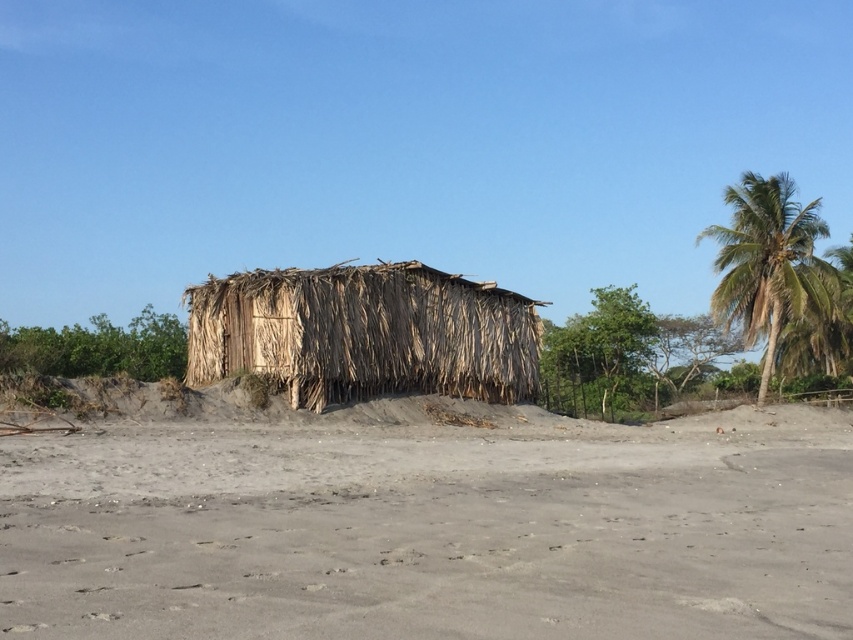
Does point (509, 314) come farther from viewer compared to point (790, 269)?

That is False.

Between dry grass hut at center and green leafy palm tree at upper right, which one has less height?

dry grass hut at center is shorter.

The height and width of the screenshot is (640, 853). Describe the element at coordinates (364, 333) in the screenshot. I see `dry grass hut at center` at that location.

The width and height of the screenshot is (853, 640). I want to click on dry grass hut at center, so click(x=364, y=333).

Does gray sandy beach at center have a smaller size compared to green leafy palm tree at upper right?

Indeed, gray sandy beach at center has a smaller size compared to green leafy palm tree at upper right.

The height and width of the screenshot is (640, 853). I want to click on gray sandy beach at center, so click(433, 531).

Is gray sandy beach at center taller than dry grass hut at center?

In fact, gray sandy beach at center may be shorter than dry grass hut at center.

Looking at this image, is the position of gray sandy beach at center more distant than that of dry grass hut at center?

No, it is in front of dry grass hut at center.

What do you see at coordinates (433, 531) in the screenshot?
I see `gray sandy beach at center` at bounding box center [433, 531].

You are a GUI agent. You are given a task and a screenshot of the screen. Output one action in this format:
    pyautogui.click(x=<x>, y=<y>)
    Task: Click on the gray sandy beach at center
    
    Given the screenshot: What is the action you would take?
    pyautogui.click(x=433, y=531)